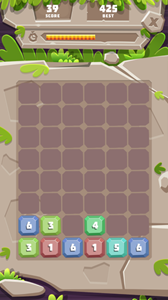
Where is `clock`? clock is located at coordinates (32, 36).